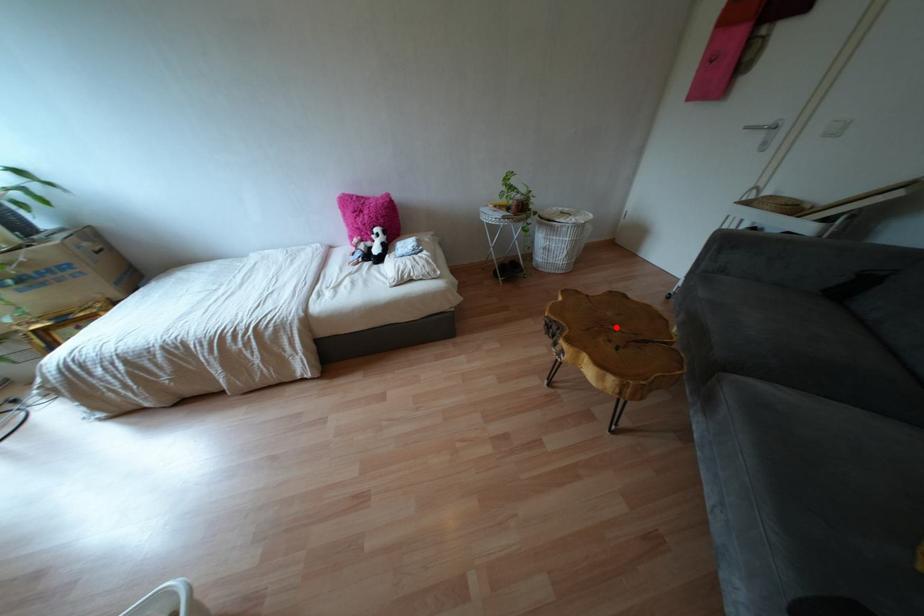
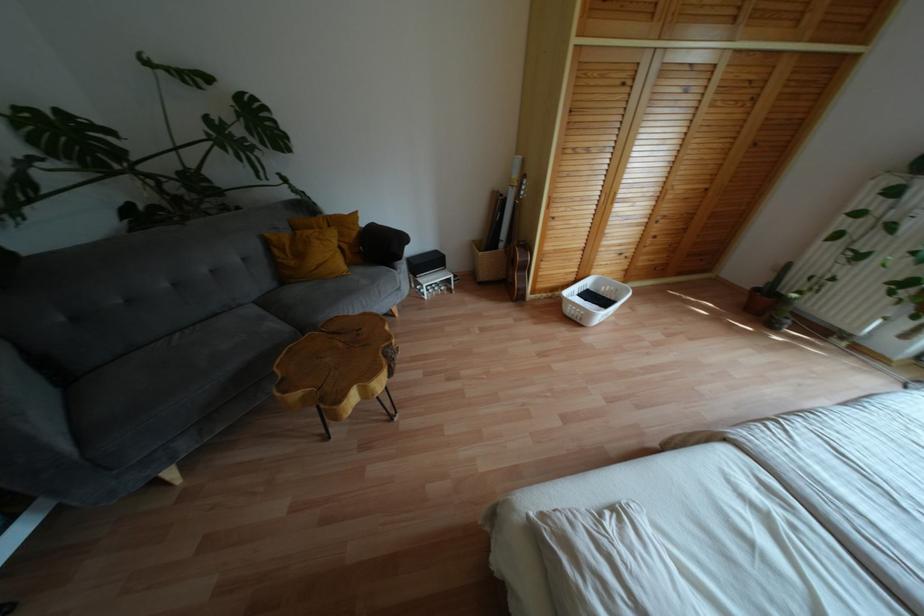
Question: A red point is marked in image1. In image2, is the corresponding 3D point closer to the camera or farther? Reply with the corresponding letter.

Choices:
 (A) The corresponding 3D point is closer.
 (B) The corresponding 3D point is farther.

Answer: (B)